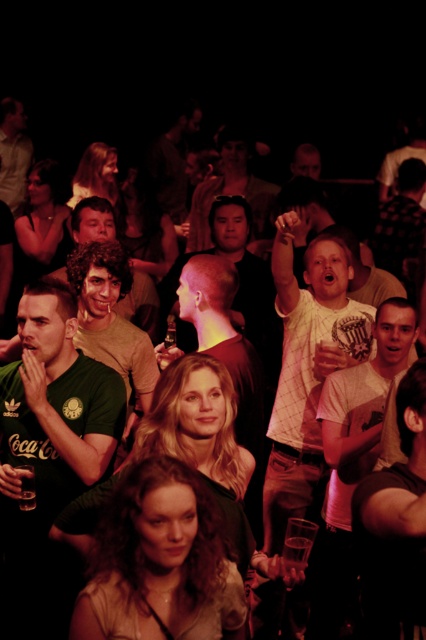
You are standing at the point labeled point (19, 173) and want to take a photo of the scene. If you move forward towards the camera, will you get a better view of the point labeled point (388, 220)?

Point (388, 220) is closer to the camera than point (19, 173). Moving forward towards the camera from point (19, 173) would actually take you away from point (388, 220), so you won t get a better view.

You are at a social event and notice two features in the crowd. One is the green jersey at center and the other is the shiny silver hair at center. Which one is positioned higher up in the image?

The green jersey at center is located above the shiny silver hair at center, so it is positioned higher up in the image.